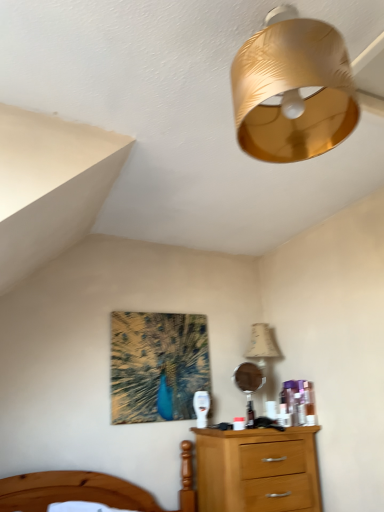
Question: Is gold textured lampshade at upper center located outside beige fabric lampshade at upper right?

Choices:
 (A) no
 (B) yes

Answer: (B)

Question: From a real-world perspective, is gold textured lampshade at upper center below beige fabric lampshade at upper right?

Choices:
 (A) no
 (B) yes

Answer: (A)

Question: Does gold textured lampshade at upper center have a greater width compared to beige fabric lampshade at upper right?

Choices:
 (A) no
 (B) yes

Answer: (B)

Question: Is the position of gold textured lampshade at upper center more distant than that of beige fabric lampshade at upper right?

Choices:
 (A) no
 (B) yes

Answer: (A)

Question: Considering the relative sizes of gold textured lampshade at upper center and beige fabric lampshade at upper right in the image provided, is gold textured lampshade at upper center shorter than beige fabric lampshade at upper right?

Choices:
 (A) yes
 (B) no

Answer: (A)

Question: Considering the relative positions of beige fabric lampshade at upper right and gold textured lampshade at upper center in the image provided, is beige fabric lampshade at upper right to the left or to the right of gold textured lampshade at upper center?

Choices:
 (A) left
 (B) right

Answer: (B)

Question: Relative to gold textured lampshade at upper center, is beige fabric lampshade at upper right in front or behind?

Choices:
 (A) behind
 (B) front

Answer: (A)

Question: From the image's perspective, is beige fabric lampshade at upper right above or below gold textured lampshade at upper center?

Choices:
 (A) below
 (B) above

Answer: (A)

Question: Is beige fabric lampshade at upper right bigger or smaller than gold textured lampshade at upper center?

Choices:
 (A) small
 (B) big

Answer: (A)

Question: Is point (238, 135) positioned closer to the camera than point (264, 410)?

Choices:
 (A) closer
 (B) farther

Answer: (A)

Question: Is gold textured lampshade at upper center bigger or smaller than beige fabric lampshade at upper right?

Choices:
 (A) small
 (B) big

Answer: (B)

Question: From a real-world perspective, relative to beige fabric lampshade at upper right, is gold textured lampshade at upper center vertically above or below?

Choices:
 (A) above
 (B) below

Answer: (A)

Question: Relative to beige fabric lampshade at upper right, is gold textured lampshade at upper center in front or behind?

Choices:
 (A) behind
 (B) front

Answer: (B)

Question: From a real-world perspective, is gold textured lampshade at upper center positioned above or below metallic round mirror at center?

Choices:
 (A) below
 (B) above

Answer: (B)

Question: Relative to metallic round mirror at center, is gold textured lampshade at upper center in front or behind?

Choices:
 (A) behind
 (B) front

Answer: (B)